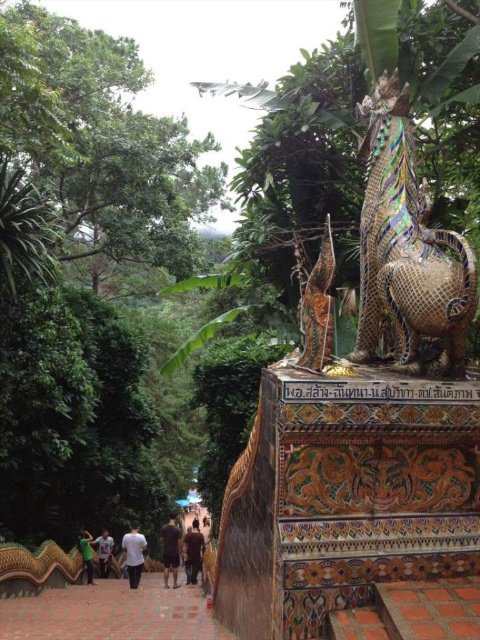
Question: Does shiny mosaic dragon at center lie in front of white cotton shirt at center?

Choices:
 (A) yes
 (B) no

Answer: (A)

Question: Considering the real-world distances, which object is farthest from the brown leather jacket at center?

Choices:
 (A) dark brown cotton shirt at center
 (B) dark green fabric at lower left
 (C) white matte shirt at lower center
 (D) terracotta tile path at lower center

Answer: (D)

Question: Which point appears closest to the camera in this image?

Choices:
 (A) (196, 577)
 (B) (105, 556)

Answer: (B)

Question: Where is shiny mosaic dragon at center located in relation to white cotton shirt at center in the image?

Choices:
 (A) above
 (B) below

Answer: (A)

Question: Is dark brown cotton shirt at center further to camera compared to brown leather jacket at center?

Choices:
 (A) no
 (B) yes

Answer: (A)

Question: Which point appears farthest from the camera in this image?

Choices:
 (A) (418, 307)
 (B) (196, 524)

Answer: (B)